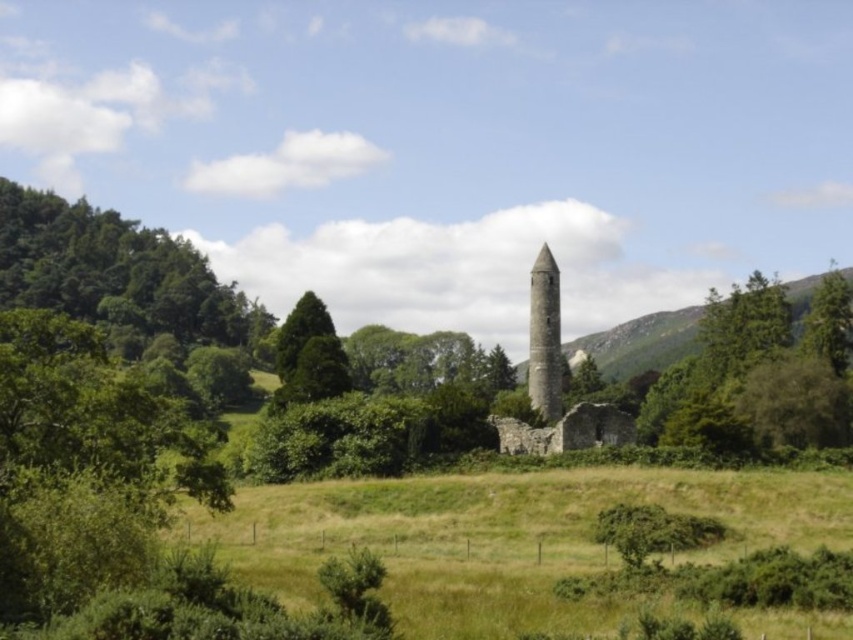
Question: Which point is closer to the camera?

Choices:
 (A) (825, 321)
 (B) (531, 323)

Answer: (B)

Question: In this image, where is green grassy field at center located relative to stone tower at center?

Choices:
 (A) below
 (B) above

Answer: (A)

Question: Can you confirm if green stone obelisk at center is thinner than green leafy tree at right?

Choices:
 (A) yes
 (B) no

Answer: (A)

Question: Based on their relative distances, which object is nearer to the green leafy tree at left?

Choices:
 (A) green stone obelisk at center
 (B) green leafy tree at right

Answer: (B)

Question: Which of the following is the farthest from the observer?

Choices:
 (A) (807, 348)
 (B) (64, 228)
 (C) (583, 541)

Answer: (B)

Question: Can you confirm if green grassy field at center is thinner than green stone obelisk at center?

Choices:
 (A) yes
 (B) no

Answer: (B)